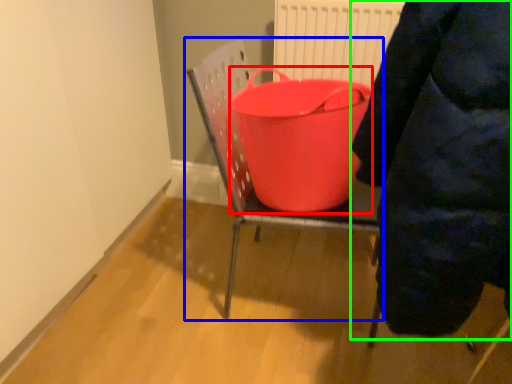
Question: Which object is the farthest from basin (highlighted by a red box)? Choose among these: furniture (highlighted by a blue box) or person (highlighted by a green box).

Choices:
 (A) furniture
 (B) person

Answer: (B)